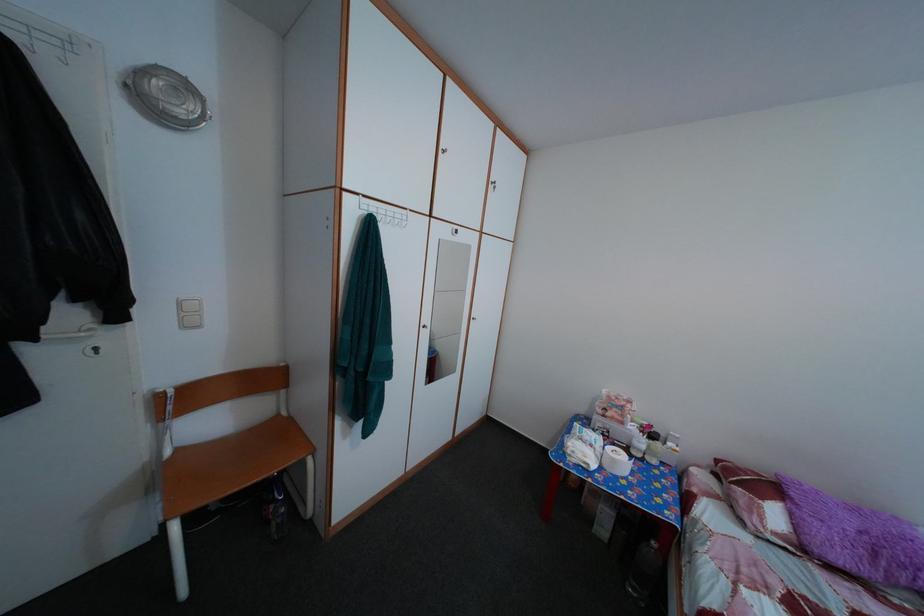
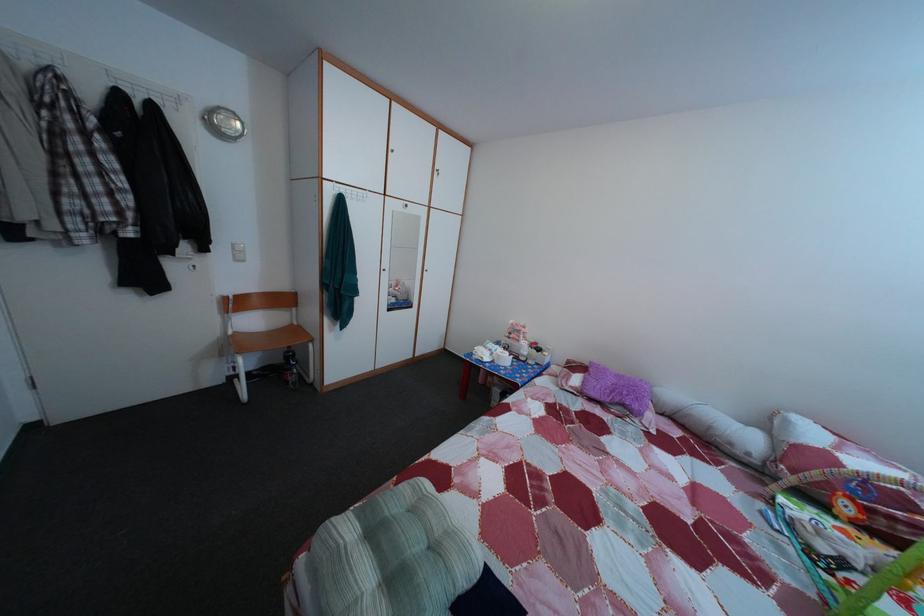
Locate, in the second image, the point that corresponds to pixel 188 310 in the first image.

(242, 254)